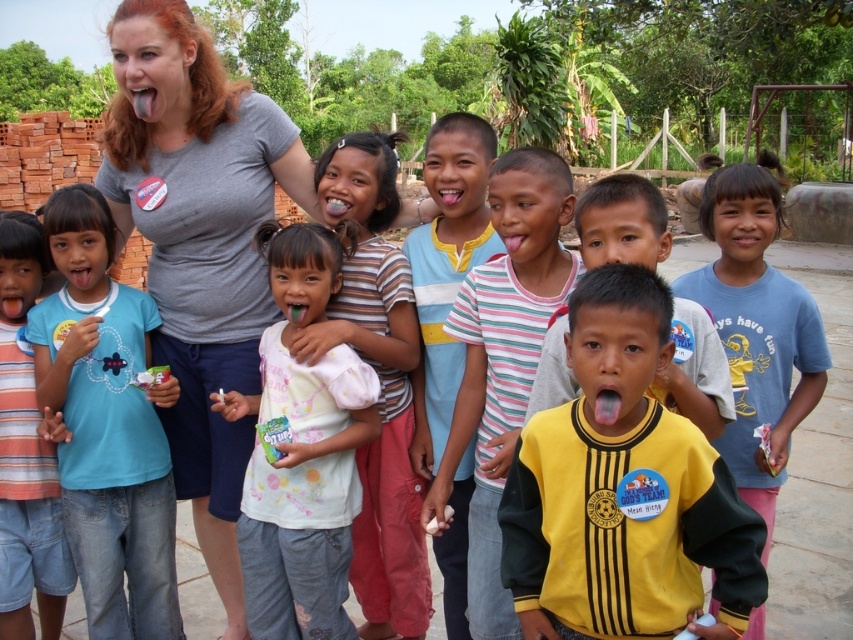
Question: Estimate the real-world distances between objects in this image. Which object is closer to the matte plastic mouth at center?

Choices:
 (A) blue cotton shirt at center
 (B) blue cotton shirt at left
 (C) striped cotton shirt at center
 (D) gray matte shirt at upper center

Answer: (C)

Question: Does blue cotton shirt at left appear under blue striped shirt at center?

Choices:
 (A) yes
 (B) no

Answer: (B)

Question: Is white cotton shirt at center bigger than matte plastic mouth at center?

Choices:
 (A) yes
 (B) no

Answer: (B)

Question: Is striped cotton shirt at center further to camera compared to blue striped shirt at center?

Choices:
 (A) no
 (B) yes

Answer: (A)

Question: Which point is farther to the camera?

Choices:
 (A) (791, 355)
 (B) (498, 365)
 (C) (44, 497)
 (D) (583, 419)

Answer: (C)

Question: Which object is positioned farthest from the striped cotton shirt at center?

Choices:
 (A) white cotton shirt at center
 (B) blue cotton shirt at left
 (C) blue striped shirt at center
 (D) yellow jersey at center

Answer: (C)